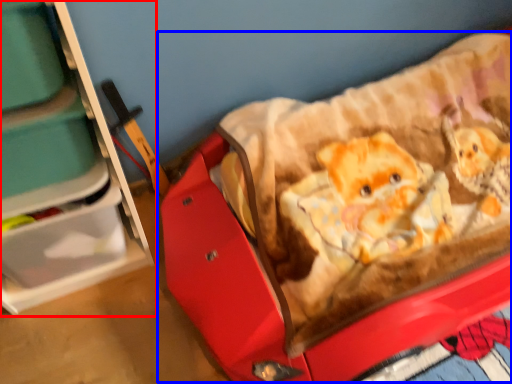
Question: Among these objects, which one is nearest to the camera, furniture (highlighted by a red box) or baby carriage (highlighted by a blue box)?

Choices:
 (A) furniture
 (B) baby carriage

Answer: (A)